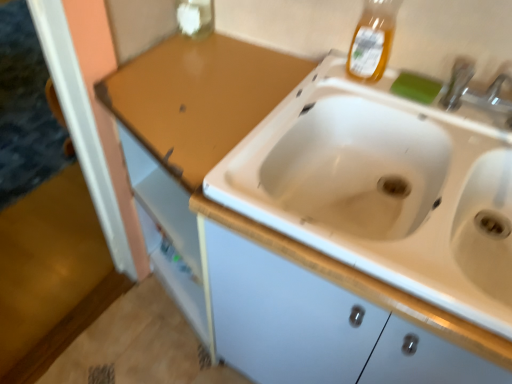
Identify the location of empty space that is to the right of transparent glass bottle at upper center, the 2th bottle from the right. The image size is (512, 384). (240, 49).